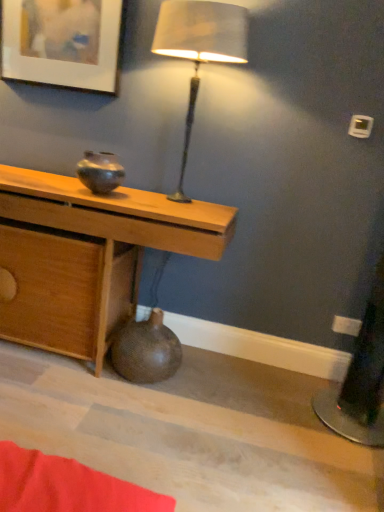
I want to click on vacant space to the right of brown textured vase at lower center, placed as the first vase when sorted from bottom to top, so click(x=202, y=389).